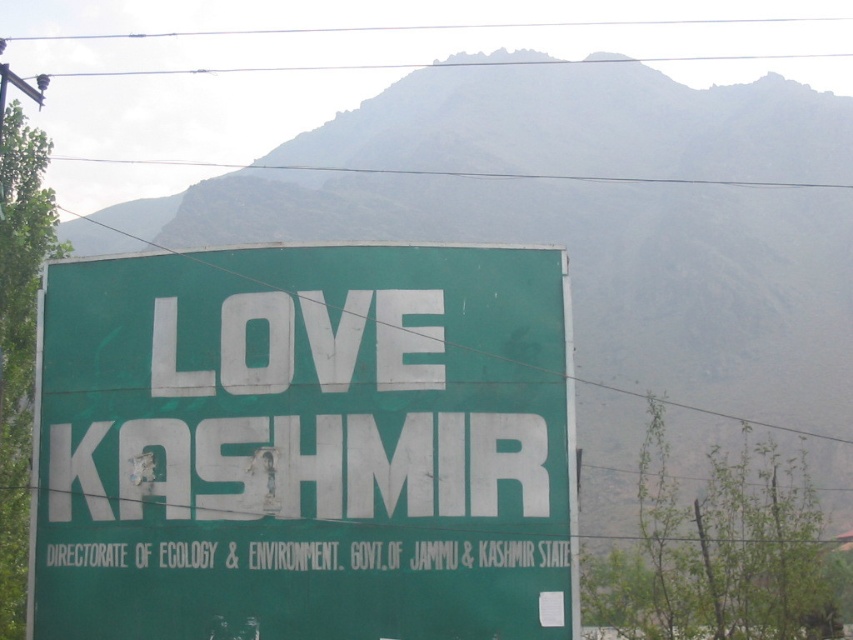
Can you confirm if green matte signboard at center is smaller than green textured mountain at upper center?

Indeed, green matte signboard at center has a smaller size compared to green textured mountain at upper center.

Is green matte signboard at center positioned in front of green textured mountain at upper center?

Yes, green matte signboard at center is in front of green textured mountain at upper center.

Who is more forward, (44, 492) or (577, 76)?

Point (44, 492) is more forward.

Locate an element on the screen. The height and width of the screenshot is (640, 853). green matte signboard at center is located at coordinates (305, 445).